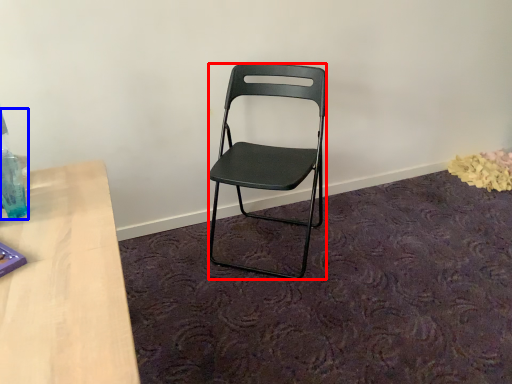
Question: Which object appears farthest to the camera in this image, chair (highlighted by a red box) or bottle (highlighted by a blue box)?

Choices:
 (A) chair
 (B) bottle

Answer: (A)